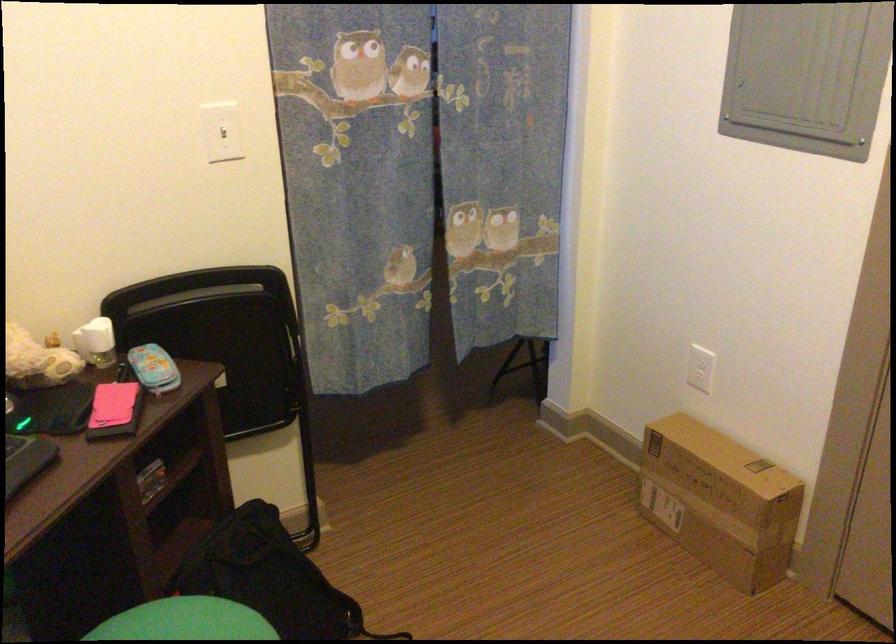
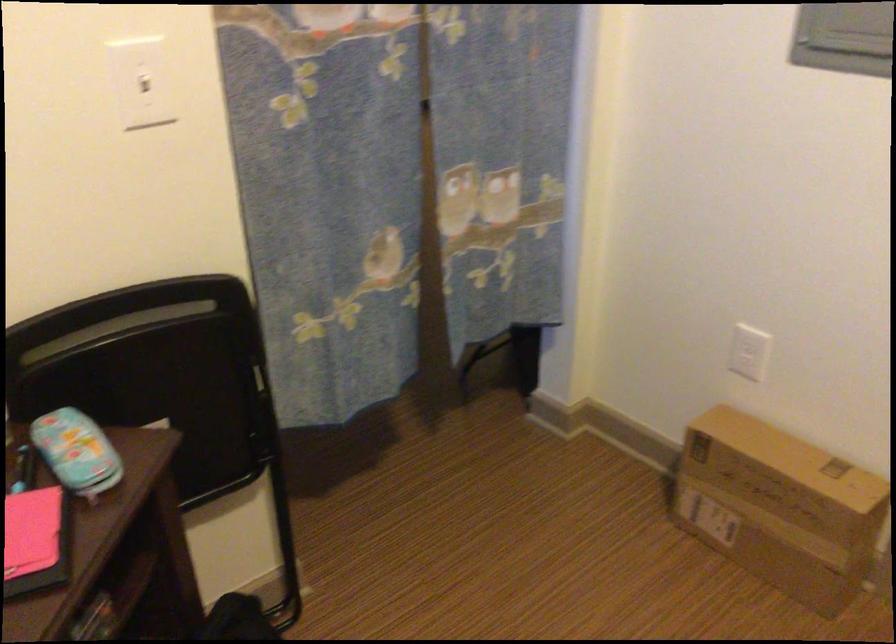
The images are taken continuously from a first-person perspective. In which direction are you moving?

The cameraman walked toward left, forward.